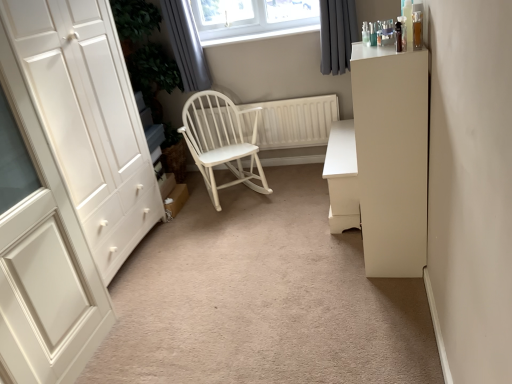
The image size is (512, 384). Find the location of `free space in front of white matte cabinet at right`. free space in front of white matte cabinet at right is located at coordinates (389, 294).